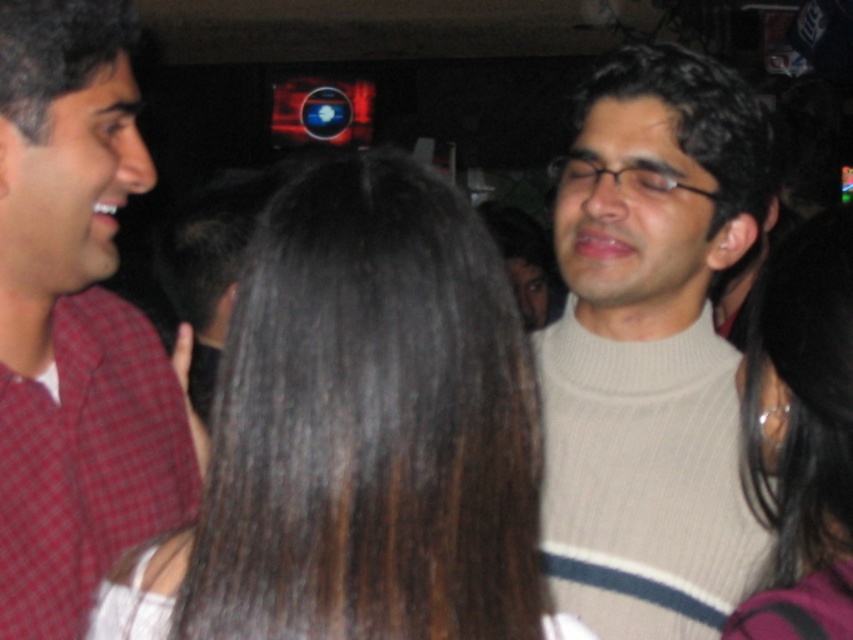
How far apart are brown hair at center and smooth black hair at right?

They are 30.18 centimeters apart.

Is point (251, 564) more distant than point (775, 506)?

No, (251, 564) is closer to viewer.

Is point (344, 420) less distant than point (753, 346)?

That is True.

Locate an element on the screen. The height and width of the screenshot is (640, 853). brown hair at center is located at coordinates (360, 435).

Who is positioned more to the right, brown hair at center or red plaid shirt at left?

Positioned to the right is brown hair at center.

Between point (233, 364) and point (84, 358), which one is positioned behind?

Positioned behind is point (84, 358).

Where is `brown hair at center`? This screenshot has height=640, width=853. brown hair at center is located at coordinates (360, 435).

Who is positioned more to the right, red plaid shirt at left or smooth black hair at right?

smooth black hair at right

Between red plaid shirt at left and smooth black hair at right, which one is positioned lower?

Positioned lower is smooth black hair at right.

Image resolution: width=853 pixels, height=640 pixels. Find the location of `red plaid shirt at left`. red plaid shirt at left is located at coordinates (74, 321).

Image resolution: width=853 pixels, height=640 pixels. I want to click on red plaid shirt at left, so click(x=74, y=321).